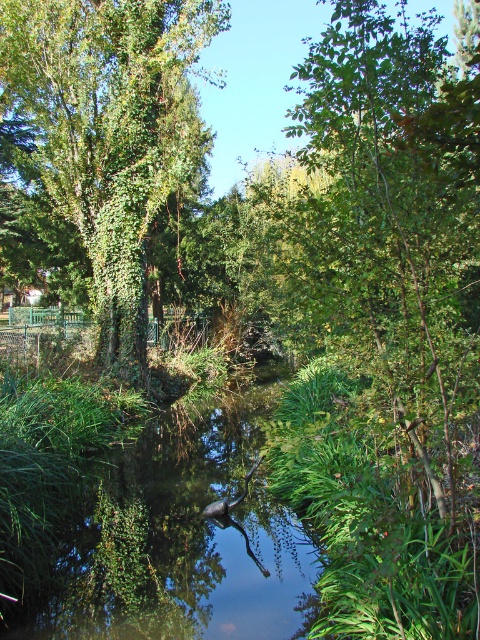
Which is in front, point (475, 52) or point (175, 176)?

Point (175, 176) is in front.

Can you confirm if green leafy tree at center is positioned to the left of green ivy-covered tree at center?

In fact, green leafy tree at center is to the right of green ivy-covered tree at center.

Between point (337, 104) and point (96, 266), which one is positioned behind?

The point (96, 266) is behind.

Locate an element on the screen. The image size is (480, 640). green leafy tree at center is located at coordinates (384, 224).